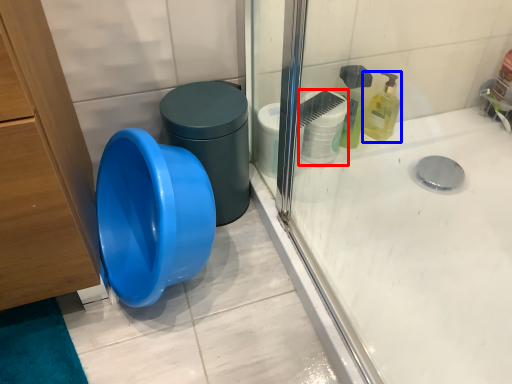
Question: Which point is closer to the camera, toilet paper (highlighted by a red box) or cleaning product (highlighted by a blue box)?

Choices:
 (A) toilet paper
 (B) cleaning product

Answer: (A)